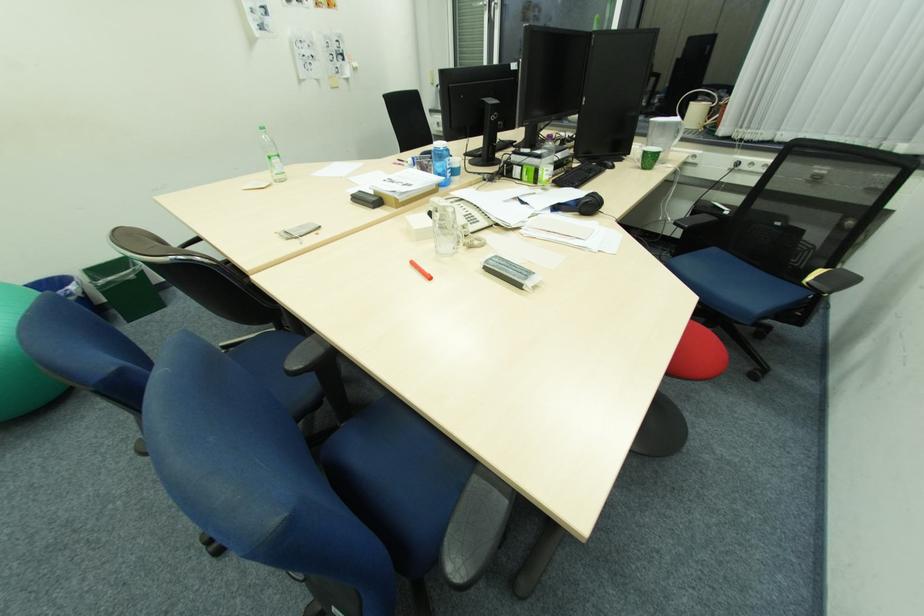
Which object does [581,205] point to?

This point indicates the black headphones.